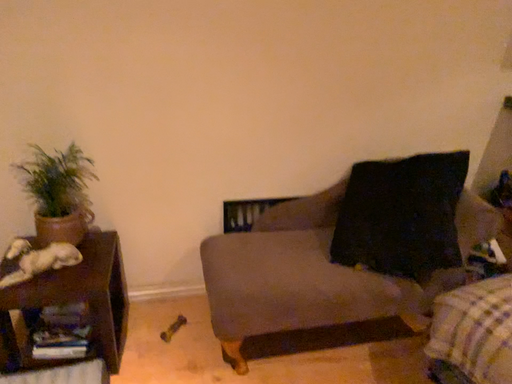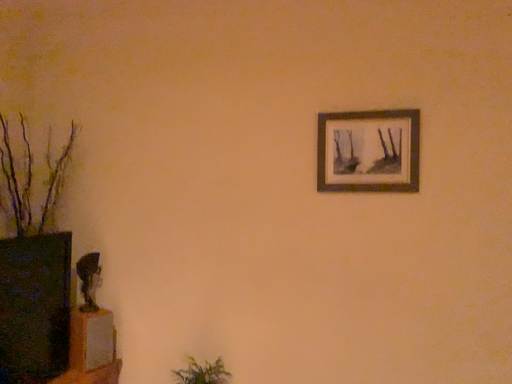
Question: Which way did the camera rotate in the video?

Choices:
 (A) rotated downward
 (B) rotated upward

Answer: (B)